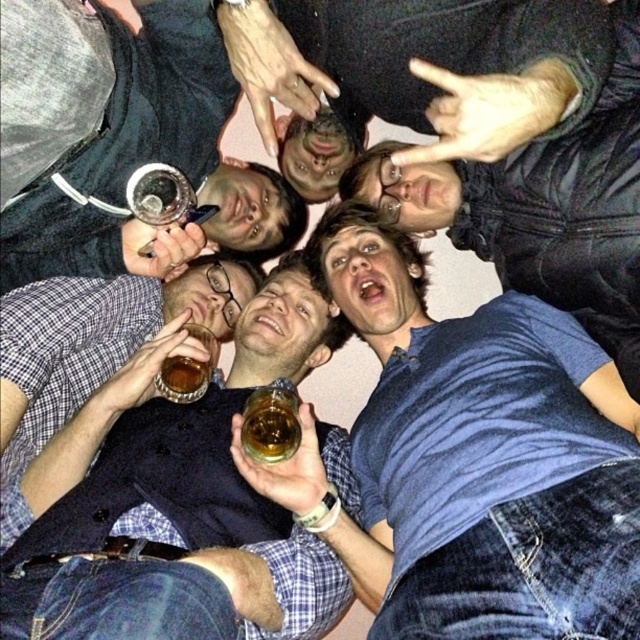
You are a photographer at a party and notice the blue cotton shirt at center and the translucent amber liquid at center. Which object is closer to the camera?

The blue cotton shirt at center is closer to the camera because it is positioned over the translucent amber liquid at center.

From the picture: You are standing in the center of the room and want to hand a gift to the person wearing the blue cotton shirt at center. In which direction should you move to reach them?

The blue cotton shirt at center is located at point (481, 458), so you should move towards the lower right direction from the center to reach them.

You are at a party and notice a blue cotton shirt at center and a translucent amber liquid at center. Which object is closer to you?

The blue cotton shirt at center is closer to you than the translucent amber liquid at center.